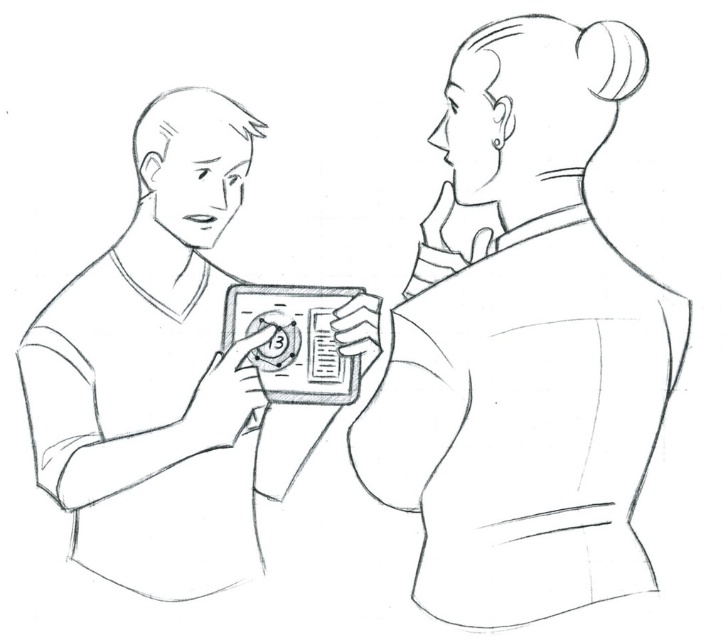
You are designing a storage box that needs to accommodate both the smooth fabric blouse at upper right and the matte black device at center. Based on their thickness, which item should be placed first into the box to ensure both fit properly?

The smooth fabric blouse at upper right is thinner than the matte black device at center, so you should place the matte black device at center first to leave enough space for the thinner blouse.

In the scene shown: You are a photographer standing in front of the scene. You want to take a portrait of the smooth fabric blouse at upper right. What is the minimum distance you should stand from the camera to ensure the blouse fills the frame properly?

The smooth fabric blouse at upper right is 1.46 meters away from the camera. To ensure it fills the frame properly, you should stand at least 1.46 meters away from the camera.

You are an AI analyzing a black and white drawing. You see a point at coordinates (523,342). Based on the scene description, what object or feature is located at that point?

The point at coordinates (523,342) marks the location of the smooth fabric blouse at upper right.